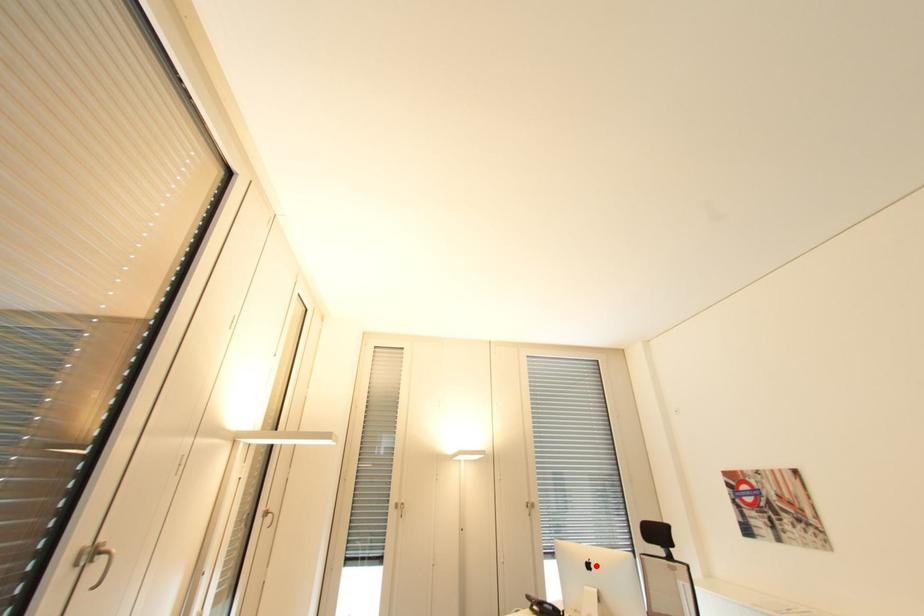
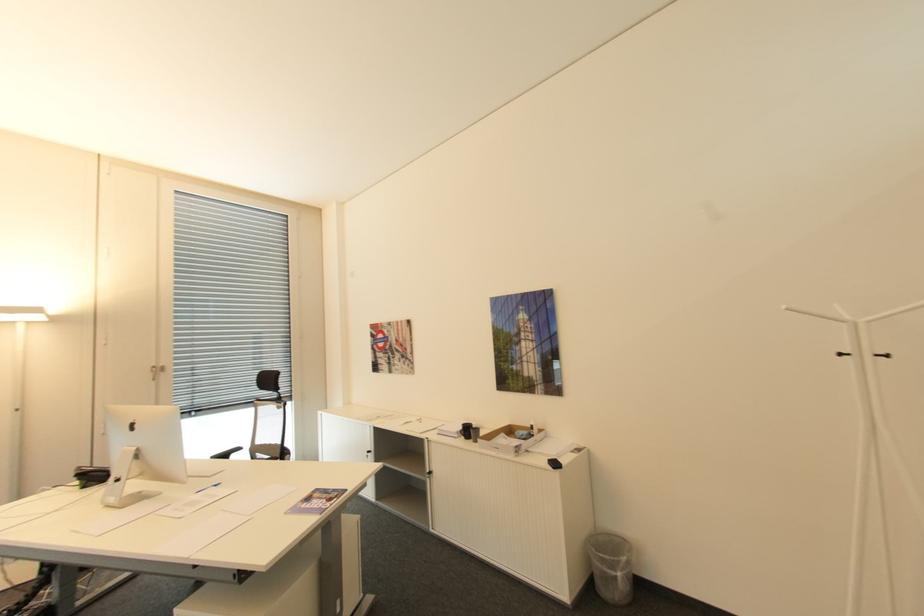
Question: I am providing you with two images of the same scene from different viewpoints. Given a red point in image1, look at the same physical point in image2. Is it:

Choices:
 (A) Closer to the viewpoint
 (B) Farther from the viewpoint

Answer: (A)